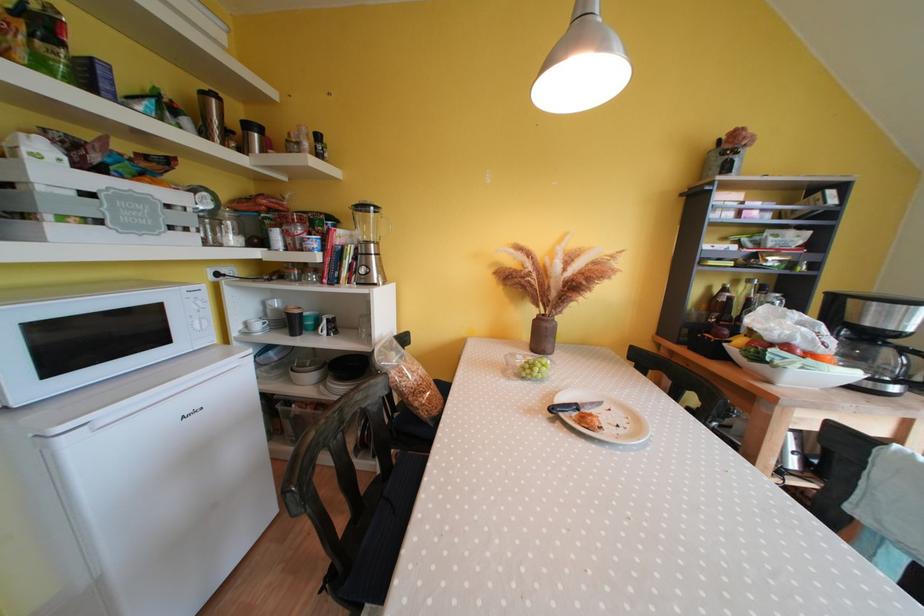
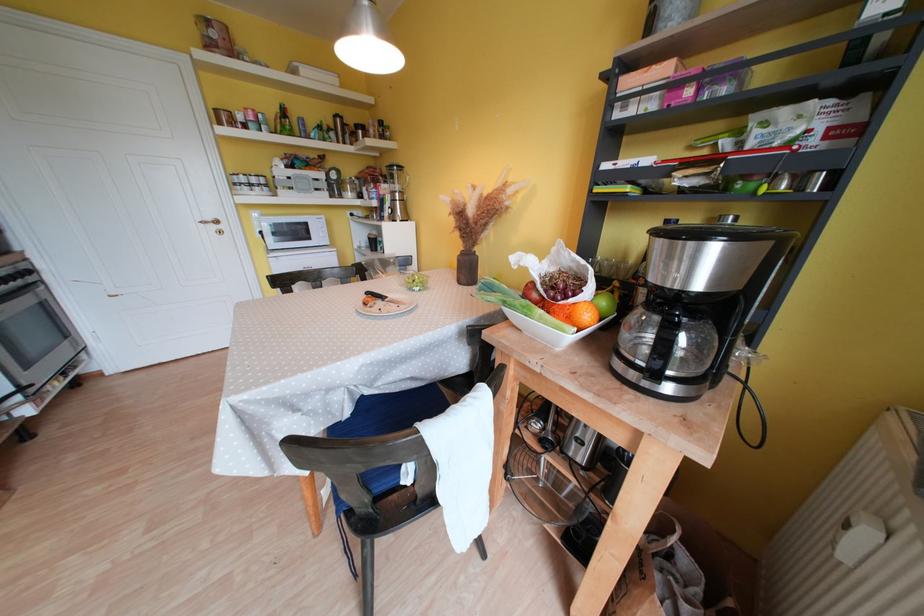
Question: I am providing you with two images of the same scene from different viewpoints. After the viewpoint changes to image2, which objects are now occluded?

Choices:
 (A) orange fruit
 (B) white fruit bowl
 (C) red apple
 (D) none of these

Answer: (D)